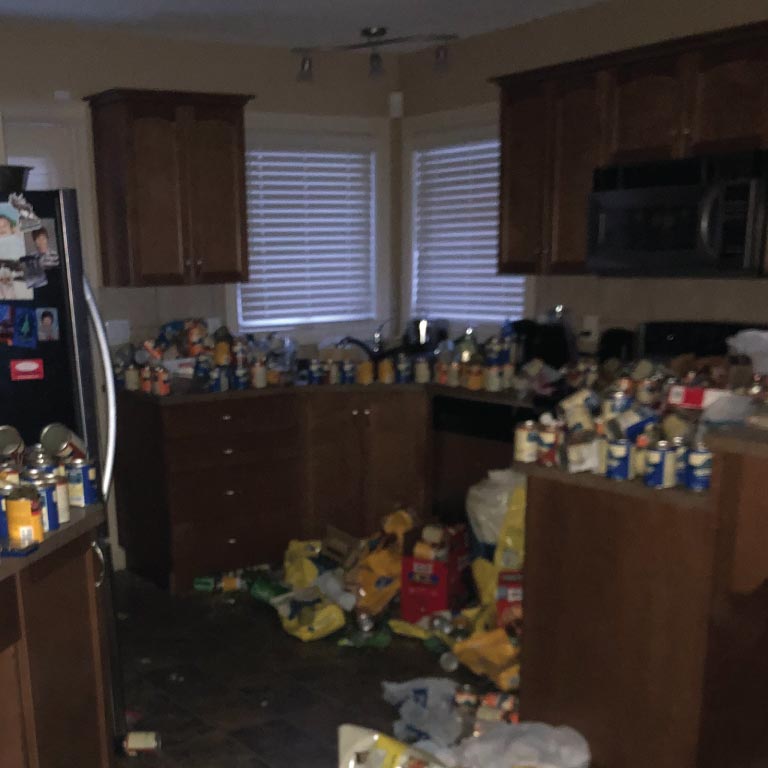
This screenshot has height=768, width=768. Find the location of `microwave`. microwave is located at coordinates coord(666,200).